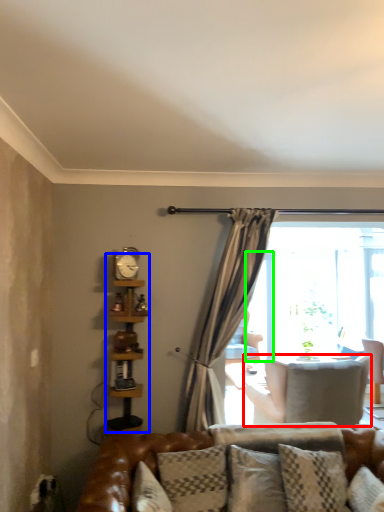
Question: Which object is positioned farthest from chair (highlighted by a red box)? Select from bookshelf (highlighted by a blue box) and screen door (highlighted by a green box).

Choices:
 (A) bookshelf
 (B) screen door

Answer: (A)